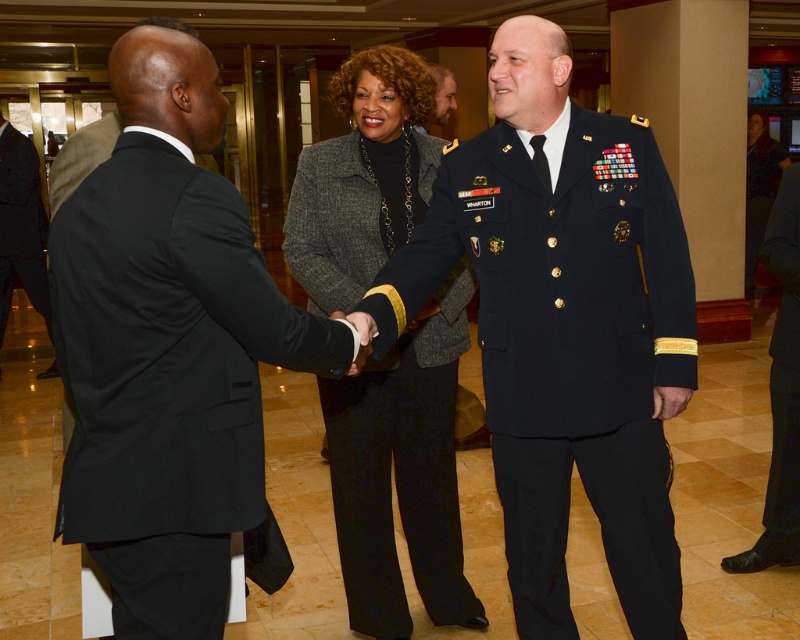
You are a photographer setting up for a group photo. You need to position two individuals so that their outfits are clearly visible. The navy blue uniform at center and the black suit at left are the subjects. Based on the scene description, which subject should you adjust to ensure both outfits are fully visible in the frame?

The navy blue uniform at center might be wider than black suit at left, so you should adjust the navy blue uniform at center to ensure it fits within the frame while keeping the black suit at left visible.

You are a photographer setting up for a formal portrait. You need to ensure that the black wool suit at left and the light brown hair at center are both visible in the frame. Based on their sizes, which object should you focus on first to ensure proper framing?

The black wool suit at left is taller than the light brown hair at center, so you should focus on the black wool suit at left first to ensure proper framing since it is larger and requires more attention in the composition.

You are standing in the formal indoor setting and want to determine which of the two points, point [360,616] or point [432,68], is closer to you. Based on the scene, which point is nearer?

Point [360,616] is closer to the viewer than point [432,68].